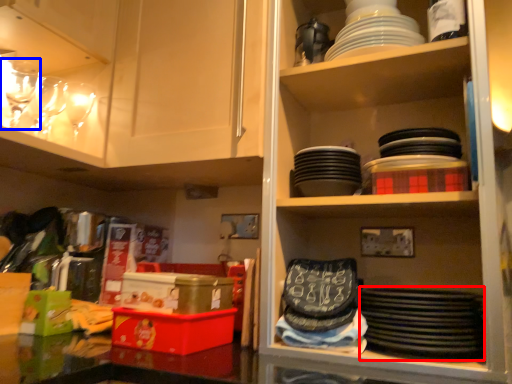
Question: Among these objects, which one is nearest to the camera, platter (highlighted by a red box) or tableware (highlighted by a blue box)?

Choices:
 (A) platter
 (B) tableware

Answer: (A)